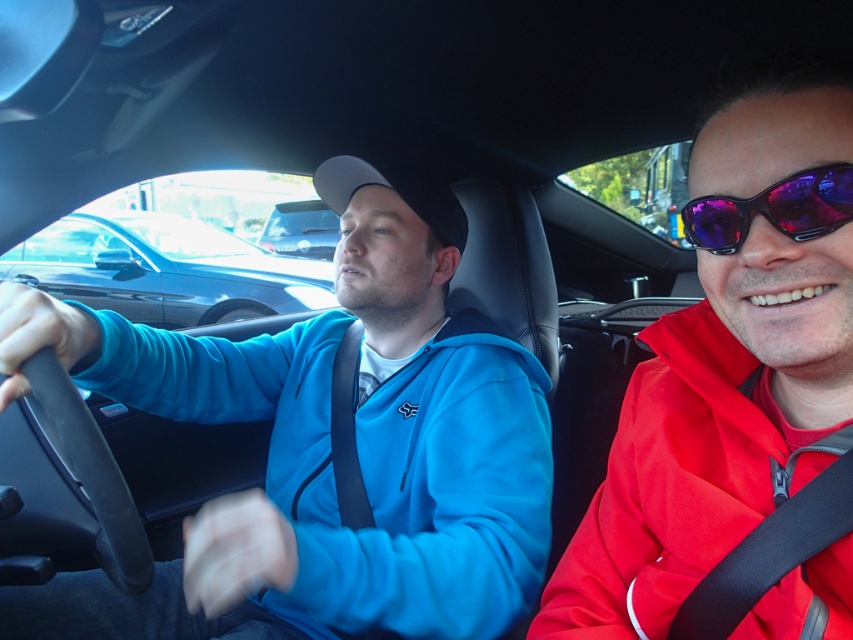
You are sitting in the passenger seat of the car and notice two points inside the vehicle. The first point is at coordinates point [55,435] and the second point is at coordinates point [306,214]. Which point is closer to you?

Point [55,435] is closer to the viewer than point [306,214].

You are sitting in the passenger seat of a car and notice the purple reflective sunglasses at right. Based on their position coordinates, can you determine if they are closer to the front or back of the car?

The purple reflective sunglasses at right are located at coordinates point (x=773, y=209). Since the y coordinate is closer to 1, which typically represents the bottom of the image, this suggests they are positioned near the lower part of the car interior, likely closer to the back of the car.

You are a delivery robot that needs to place a package between the black matte steering wheel at left and the passenger seat. The package is 90 centimeters long. Will it fit?

The distance between the black matte steering wheel at left and the passenger seat is 89.03 centimeters. Since the package is 90 centimeters long, it will not fit in the available space.